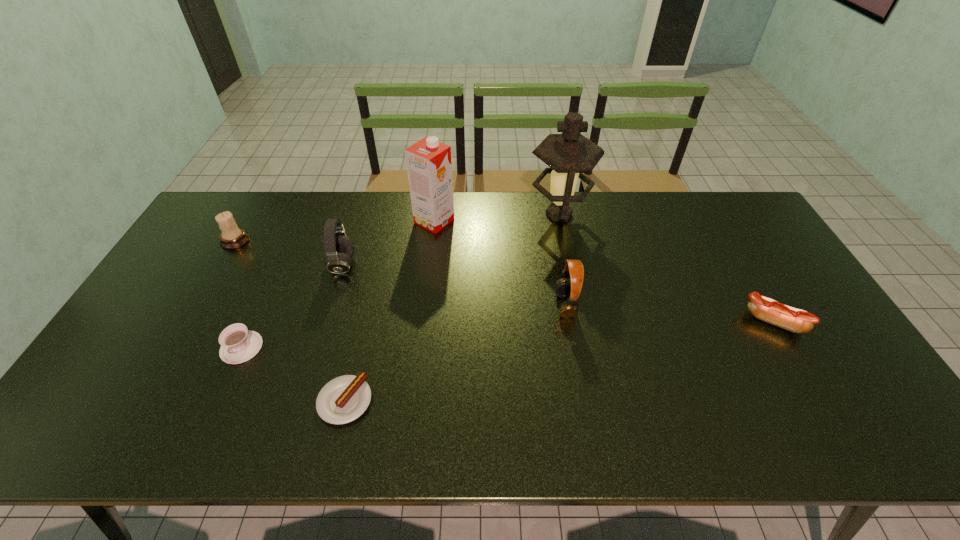
Identify the location of vacant space in between the oil lamp and the nearest object. (452, 308).

This screenshot has height=540, width=960. What are the coordinates of `free point between the shortest object and the nearer headset` in the screenshot? It's located at (455, 353).

At what (x,y) coordinates should I click in order to perform the action: click on free spot between the nearest object and the left headset. Please return your answer as a coordinate pair (x, y). Looking at the image, I should click on (344, 333).

At what (x,y) coordinates should I click in order to perform the action: click on vacant region between the carton and the oil lamp. Please return your answer as a coordinate pair (x, y). This screenshot has height=540, width=960. Looking at the image, I should click on coord(496,218).

The image size is (960, 540). I want to click on vacant space in between the left sausage and the fifth object from left to right, so click(x=390, y=311).

Find the location of a particular element. object that ranks as the closest to the fifth object from left to right is located at coordinates (339, 249).

Locate an element on the screen. The height and width of the screenshot is (540, 960). the seventh closest object to the teacup is located at coordinates (766, 309).

Locate an element on the screen. The height and width of the screenshot is (540, 960). free location that satisfies the following two spatial constraints: 1. on the back side of the oil lamp; 2. on the right side of the nearest object is located at coordinates (389, 214).